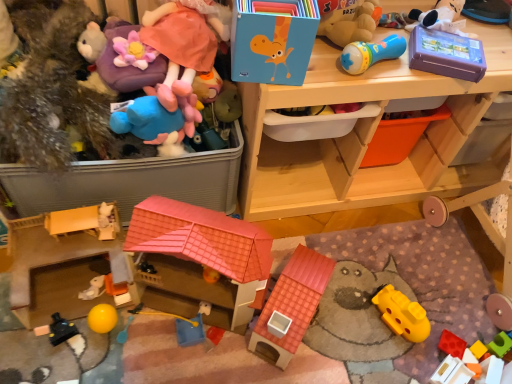
You are a GUI agent. You are given a task and a screenshot of the screen. Output one action in this format:
    pyautogui.click(x=<x>, y=<y>)
    Task: Click on the free space to the back side of black plastic toy at lower left, the 13th toy viewed from the right
    The width and height of the screenshot is (512, 384).
    Given the screenshot: What is the action you would take?
    pyautogui.click(x=66, y=291)